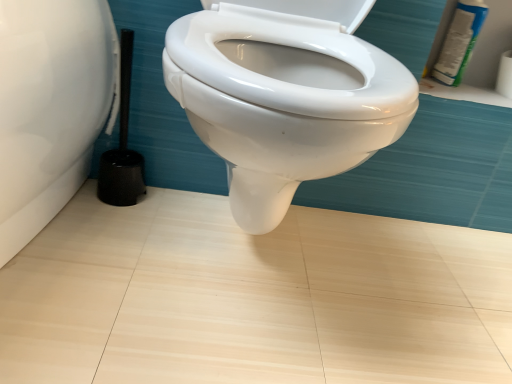
Question: From a real-world perspective, is white glossy spray can at upper right under black plastic brush at left?

Choices:
 (A) no
 (B) yes

Answer: (A)

Question: Can you confirm if white glossy spray can at upper right is smaller than black plastic brush at left?

Choices:
 (A) no
 (B) yes

Answer: (B)

Question: Is white glossy spray can at upper right completely or partially outside of black plastic brush at left?

Choices:
 (A) no
 (B) yes

Answer: (B)

Question: Can you confirm if white glossy spray can at upper right is positioned to the left of black plastic brush at left?

Choices:
 (A) yes
 (B) no

Answer: (B)

Question: Is white glossy spray can at upper right closer to the viewer compared to black plastic brush at left?

Choices:
 (A) no
 (B) yes

Answer: (A)

Question: Is white glossy spray can at upper right further to the viewer compared to black plastic brush at left?

Choices:
 (A) yes
 (B) no

Answer: (A)

Question: Considering the relative positions of black plastic brush at left and white glossy spray can at upper right in the image provided, is black plastic brush at left to the right of white glossy spray can at upper right from the viewer's perspective?

Choices:
 (A) yes
 (B) no

Answer: (B)

Question: From the image's perspective, would you say black plastic brush at left is shown under white glossy spray can at upper right?

Choices:
 (A) yes
 (B) no

Answer: (A)

Question: From the image's perspective, is black plastic brush at left on white glossy spray can at upper right?

Choices:
 (A) yes
 (B) no

Answer: (B)

Question: Does black plastic brush at left have a greater width compared to white glossy spray can at upper right?

Choices:
 (A) yes
 (B) no

Answer: (A)

Question: Does black plastic brush at left have a greater height compared to white glossy spray can at upper right?

Choices:
 (A) yes
 (B) no

Answer: (A)

Question: Would you say white glossy spray can at upper right is part of black plastic brush at left's contents?

Choices:
 (A) yes
 (B) no

Answer: (B)

Question: Based on their sizes in the image, would you say white glossy spray can at upper right is bigger or smaller than black plastic brush at left?

Choices:
 (A) big
 (B) small

Answer: (B)